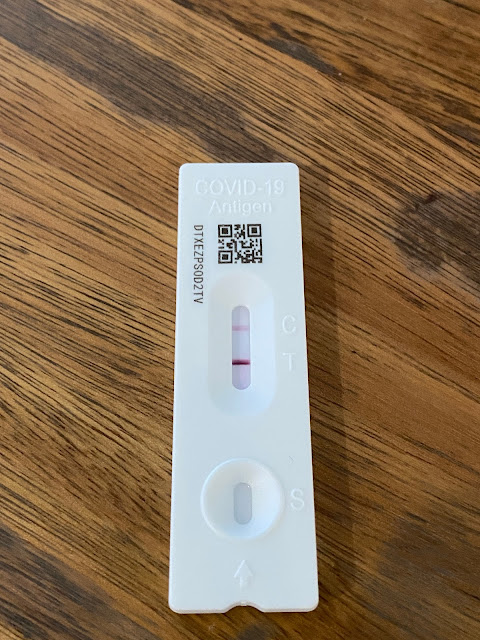
Where is `this is the large oval test window`? this is the large oval test window is located at coordinates (241, 388), (242, 305).